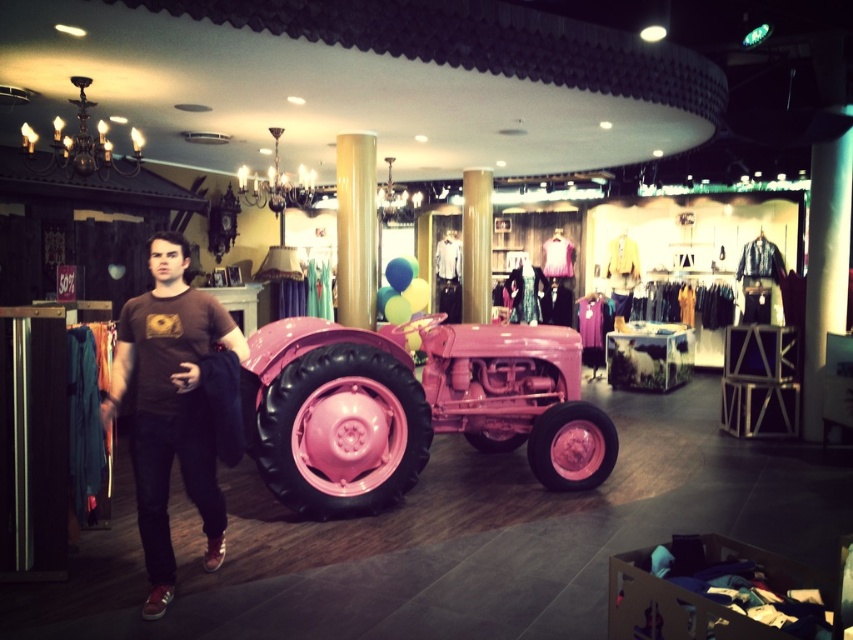
Question: Is pink glossy tractor at center wider than brown cotton t-shirt at center?

Choices:
 (A) no
 (B) yes

Answer: (B)

Question: Does pink glossy tractor at center appear over brown cotton t-shirt at center?

Choices:
 (A) no
 (B) yes

Answer: (A)

Question: Does pink glossy tractor at center have a greater width compared to brown cotton t-shirt at center?

Choices:
 (A) no
 (B) yes

Answer: (B)

Question: Which point appears farthest from the camera in this image?

Choices:
 (A) (491, 364)
 (B) (223, 323)

Answer: (A)